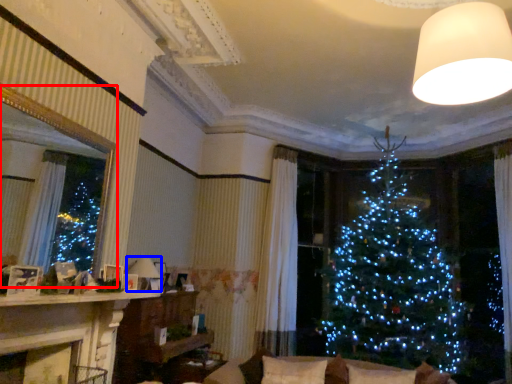
Question: Among these objects, which one is nearest to the camera, window screen (highlighted by a red box) or lamp (highlighted by a blue box)?

Choices:
 (A) window screen
 (B) lamp

Answer: (A)